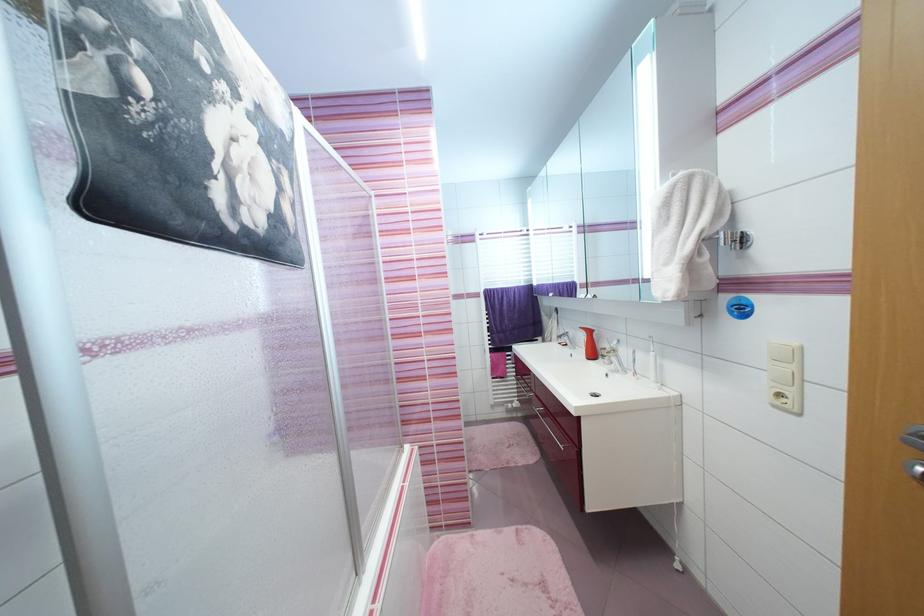
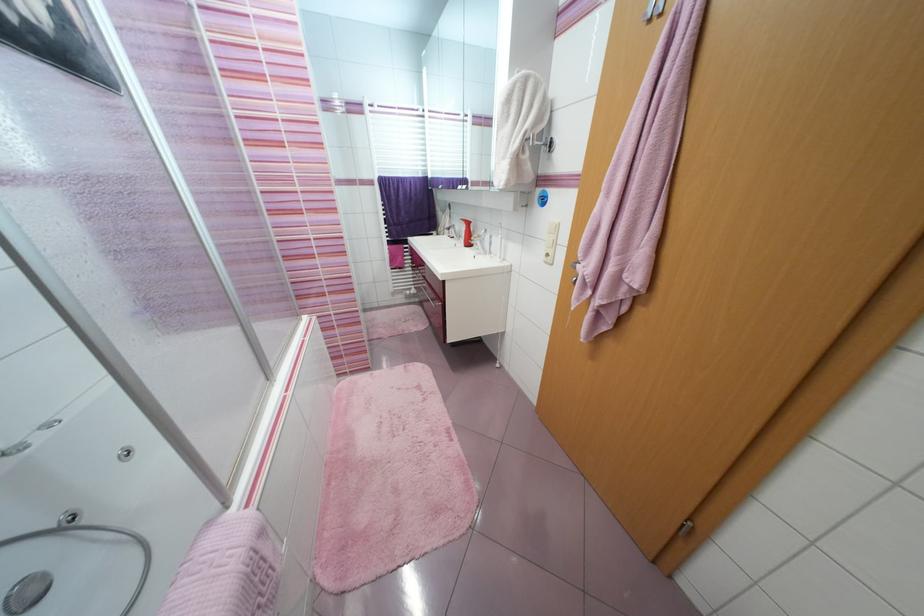
Locate, in the second image, the point that corresponds to (748,241) in the first image.

(555, 147)